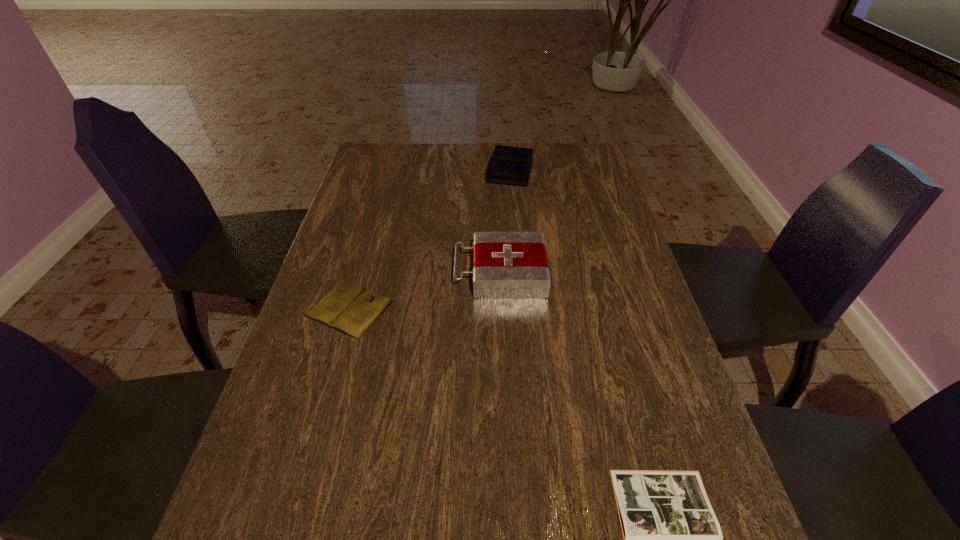
The image size is (960, 540). What are the coordinates of `object that is at the far edge` in the screenshot? It's located at (508, 165).

Locate an element on the screen. object at the left edge is located at coordinates (349, 308).

I want to click on free spot at the far edge of the desktop, so click(x=485, y=154).

You are a GUI agent. You are given a task and a screenshot of the screen. Output one action in this format:
    pyautogui.click(x=<x>, y=<y>)
    Task: Click on the free space at the left edge
    The width and height of the screenshot is (960, 540).
    Given the screenshot: What is the action you would take?
    pyautogui.click(x=348, y=217)

Identify the location of free space at the right edge of the desktop. (625, 381).

Locate an element on the screen. This screenshot has width=960, height=540. vacant region at the far right corner of the desktop is located at coordinates (574, 156).

Locate an element on the screen. The height and width of the screenshot is (540, 960). unoccupied position between the tallest object and the second tallest object is located at coordinates (505, 222).

Image resolution: width=960 pixels, height=540 pixels. Find the location of `vacant area between the leftmost object and the second book from left to right`. vacant area between the leftmost object and the second book from left to right is located at coordinates (430, 240).

This screenshot has height=540, width=960. In order to click on vacant point located between the first-aid kit and the leftmost book in this screenshot , I will do `click(425, 291)`.

Find the location of a particular element. unoccupied position between the leftmost object and the tallest object is located at coordinates click(425, 291).